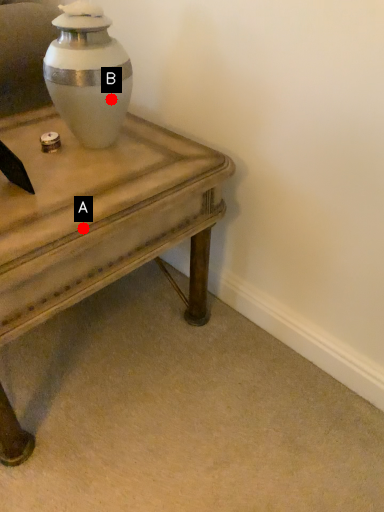
Question: Two points are circled on the image, labeled by A and B beside each circle. Which point appears closest to the camera in this image?

Choices:
 (A) A is closer
 (B) B is closer

Answer: (A)